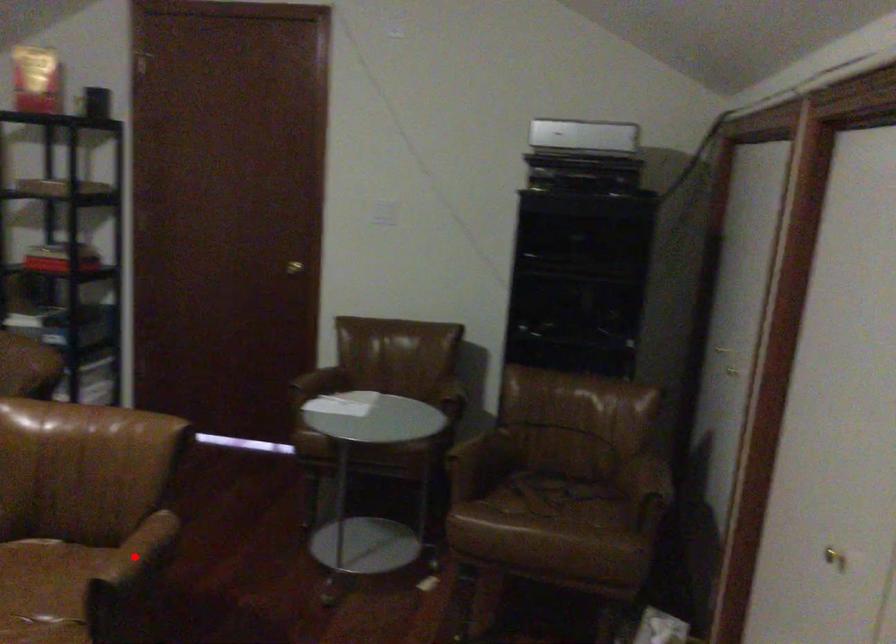
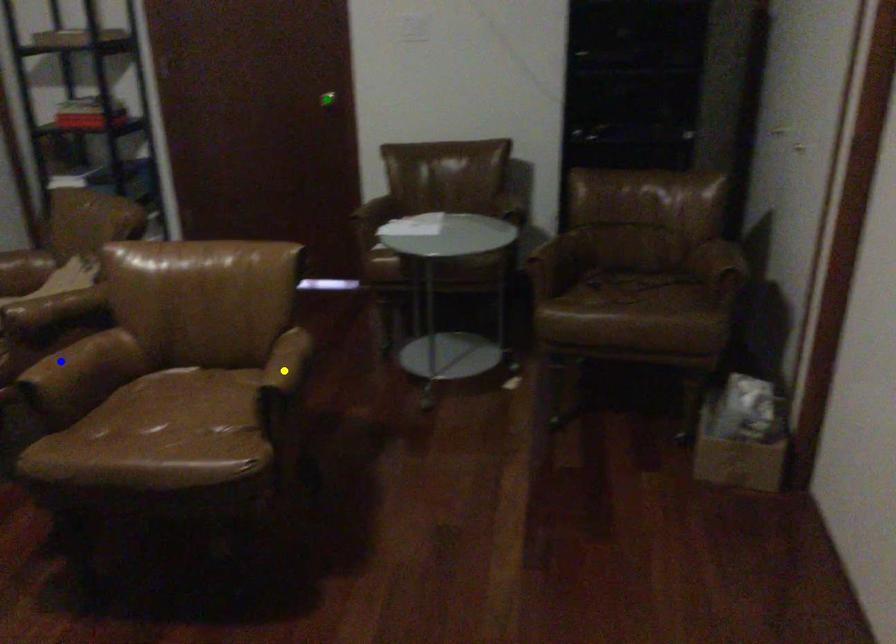
Question: I am providing you with two images of the same scene from different viewpoints. A red point is marked on the first image. You are given multiple points on the second image. Which mark in image 2 goes with the point in image 1?

Choices:
 (A) green point
 (B) yellow point
 (C) blue point

Answer: (B)